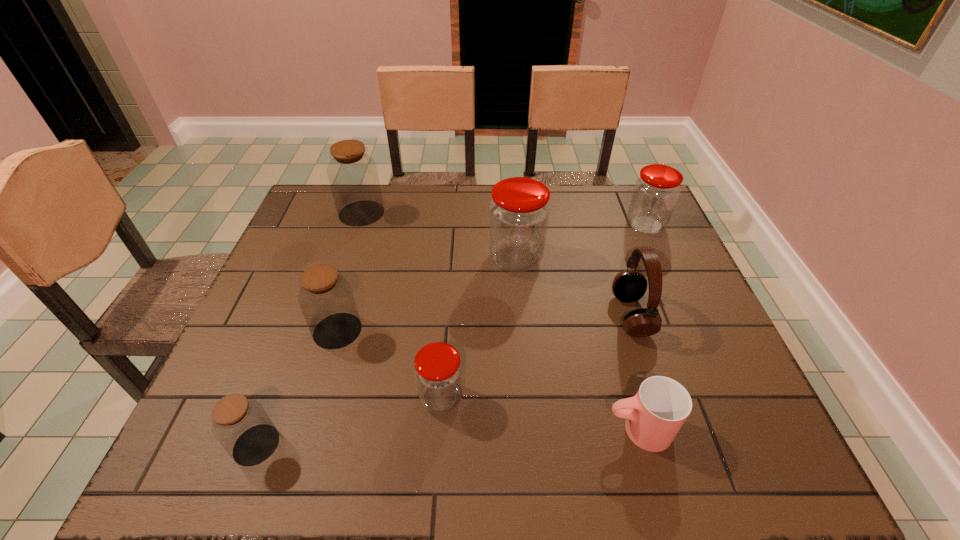
Where is `object at the near left corner`? object at the near left corner is located at coordinates (240, 424).

Where is `object present at the far right corner`? The height and width of the screenshot is (540, 960). object present at the far right corner is located at coordinates pyautogui.click(x=656, y=192).

Image resolution: width=960 pixels, height=540 pixels. Find the location of `blank space at the far edge`. blank space at the far edge is located at coordinates (489, 204).

In the image, there is a desktop. Identify the location of vacant region at the near edge. (613, 435).

In order to click on vacant space at the right edge of the desktop in this screenshot , I will do `click(727, 360)`.

Where is `free location at the far right corner`? The image size is (960, 540). free location at the far right corner is located at coordinates (627, 197).

Where is `unoccupied position between the biggest brown jar and the second biggest brown jar`? unoccupied position between the biggest brown jar and the second biggest brown jar is located at coordinates (349, 272).

Where is `empty location between the second smallest brown jar and the nearest jar`? empty location between the second smallest brown jar and the nearest jar is located at coordinates (297, 388).

Locate an element on the screen. The width and height of the screenshot is (960, 540). free space between the headset and the shortest object is located at coordinates (635, 373).

You are a GUI agent. You are given a task and a screenshot of the screen. Output one action in this format:
    pyautogui.click(x=<x>, y=<y>)
    Task: Click on the vacant space that's between the leftmost red jar and the second farthest red jar
    The height and width of the screenshot is (540, 960).
    Given the screenshot: What is the action you would take?
    pyautogui.click(x=479, y=328)